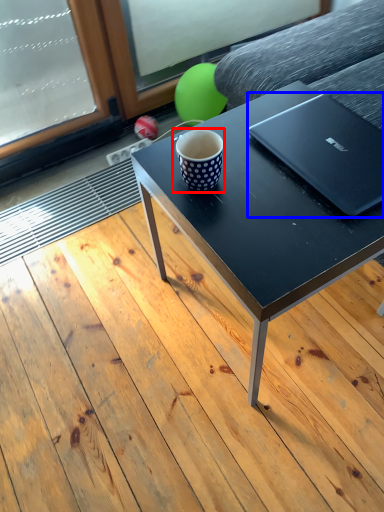
Question: Which of the following is the farthest to the observer, coffee cup (highlighted by a red box) or laptop (highlighted by a blue box)?

Choices:
 (A) coffee cup
 (B) laptop

Answer: (A)